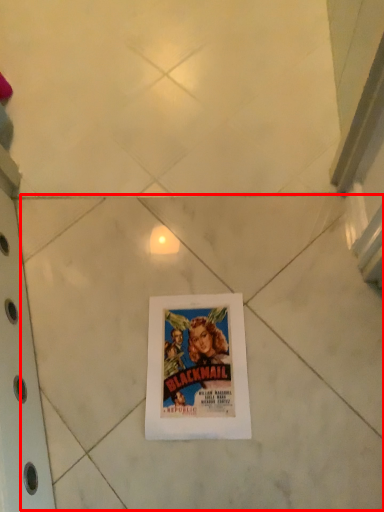
Question: From the image's perspective, what is the correct spatial relationship of tile (annotated by the red box) in relation to picture frame?

Choices:
 (A) below
 (B) above

Answer: (B)